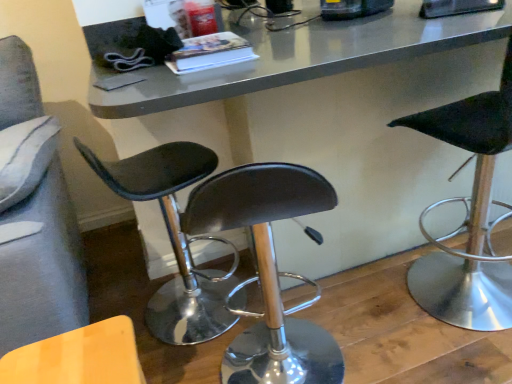
Question: Is black leather stool at right, the third chair from the left, thinner than metallic gray table at center?

Choices:
 (A) no
 (B) yes

Answer: (B)

Question: Can you confirm if black leather stool at right, the third chair from the left, is wider than metallic gray table at center?

Choices:
 (A) no
 (B) yes

Answer: (A)

Question: From a real-world perspective, is black leather stool at right, the 1th chair viewed from the right, located higher than metallic gray table at center?

Choices:
 (A) no
 (B) yes

Answer: (B)

Question: Is the position of black leather stool at right, the third chair from the left, more distant than that of metallic gray table at center?

Choices:
 (A) no
 (B) yes

Answer: (A)

Question: From the image's perspective, is black leather stool at right, the third chair from the left, above metallic gray table at center?

Choices:
 (A) no
 (B) yes

Answer: (A)

Question: Is wooden textured chair at lower left, the first chair positioned from the left, spatially inside black leather stool at center, positioned as the second chair in left-to-right order, or outside of it?

Choices:
 (A) outside
 (B) inside

Answer: (A)

Question: Is wooden textured chair at lower left, the first chair positioned from the left, wider or thinner than black leather stool at center, positioned as the second chair in left-to-right order?

Choices:
 (A) wide
 (B) thin

Answer: (B)

Question: From the image's perspective, is wooden textured chair at lower left, the first chair positioned from the left, positioned above or below black leather stool at center, which ranks as the 2th chair in right-to-left order?

Choices:
 (A) below
 (B) above

Answer: (A)

Question: In the image, is wooden textured chair at lower left, the first chair positioned from the left, positioned in front of or behind black leather stool at center, which ranks as the 2th chair in right-to-left order?

Choices:
 (A) front
 (B) behind

Answer: (A)

Question: Is black leather stool at center, positioned as the second chair in left-to-right order, to the left or to the right of black leather stool at right, the third chair from the left, in the image?

Choices:
 (A) left
 (B) right

Answer: (A)

Question: From the image's perspective, is black leather stool at center, which ranks as the 2th chair in right-to-left order, above or below black leather stool at right, the third chair from the left?

Choices:
 (A) below
 (B) above

Answer: (A)

Question: Is black leather stool at center, which ranks as the 2th chair in right-to-left order, situated inside black leather stool at right, the third chair from the left, or outside?

Choices:
 (A) outside
 (B) inside

Answer: (A)

Question: Looking at their shapes, would you say black leather stool at center, which ranks as the 2th chair in right-to-left order, is wider or thinner than black leather stool at right, the 1th chair viewed from the right?

Choices:
 (A) thin
 (B) wide

Answer: (B)

Question: Visually, is black leather stool at right, the third chair from the left, positioned to the left or to the right of metallic gray table at center?

Choices:
 (A) left
 (B) right

Answer: (B)

Question: From a real-world perspective, is black leather stool at right, the 1th chair viewed from the right, positioned above or below metallic gray table at center?

Choices:
 (A) below
 (B) above

Answer: (B)